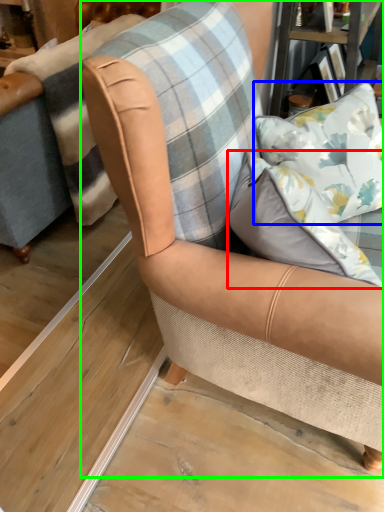
Question: Which object is positioned closest to pillow (highlighted by a red box)? Select from pillow (highlighted by a blue box) and chair (highlighted by a green box).

Choices:
 (A) pillow
 (B) chair

Answer: (B)